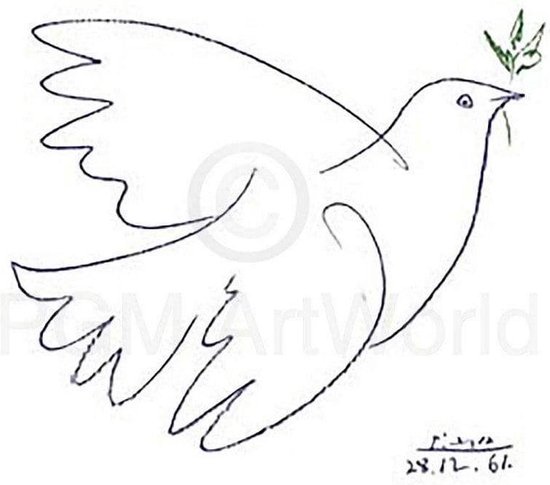
You are a GUI agent. You are given a task and a screenshot of the screen. Output one action in this format:
    pyautogui.click(x=<x>, y=<y>)
    Task: Click on the plant
    Image resolution: width=550 pixels, height=485 pixels.
    Given the screenshot: What is the action you would take?
    pyautogui.click(x=518, y=50)